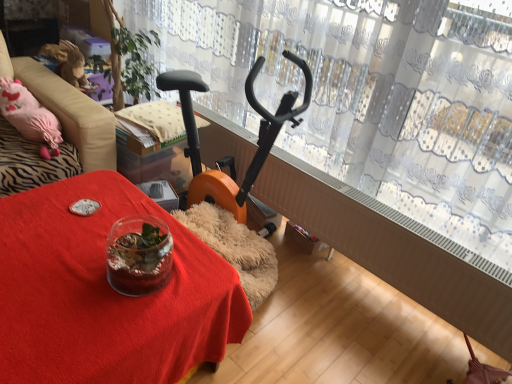
Question: Does velvet pink cushion at left appear on the right side of translucent glass terrarium at center?

Choices:
 (A) yes
 (B) no

Answer: (B)

Question: Considering the relative sizes of velvet pink cushion at left and translucent glass terrarium at center in the image provided, is velvet pink cushion at left shorter than translucent glass terrarium at center?

Choices:
 (A) no
 (B) yes

Answer: (A)

Question: Can you confirm if velvet pink cushion at left is thinner than translucent glass terrarium at center?

Choices:
 (A) no
 (B) yes

Answer: (A)

Question: From the image's perspective, is velvet pink cushion at left beneath translucent glass terrarium at center?

Choices:
 (A) no
 (B) yes

Answer: (A)

Question: Is velvet pink cushion at left directly adjacent to translucent glass terrarium at center?

Choices:
 (A) no
 (B) yes

Answer: (A)

Question: Based on their sizes in the image, would you say velvet pink cushion at left is bigger or smaller than translucent glass terrarium at center?

Choices:
 (A) small
 (B) big

Answer: (B)

Question: Does point (25, 162) appear closer or farther from the camera than point (53, 306)?

Choices:
 (A) farther
 (B) closer

Answer: (A)

Question: From the image's perspective, is velvet pink cushion at left positioned above or below translucent glass terrarium at center?

Choices:
 (A) below
 (B) above

Answer: (B)

Question: Is velvet pink cushion at left to the left or to the right of translucent glass terrarium at center in the image?

Choices:
 (A) left
 (B) right

Answer: (A)

Question: Is transparent lace curtain at upper center situated inside velvet pink cushion at left or outside?

Choices:
 (A) outside
 (B) inside

Answer: (A)

Question: In terms of width, does transparent lace curtain at upper center look wider or thinner when compared to velvet pink cushion at left?

Choices:
 (A) wide
 (B) thin

Answer: (B)

Question: Considering their positions, is transparent lace curtain at upper center located in front of or behind velvet pink cushion at left?

Choices:
 (A) front
 (B) behind

Answer: (A)

Question: From their relative heights in the image, would you say transparent lace curtain at upper center is taller or shorter than velvet pink cushion at left?

Choices:
 (A) short
 (B) tall

Answer: (B)

Question: Considering the relative positions of transparent lace curtain at upper center and translucent glass terrarium at center in the image provided, is transparent lace curtain at upper center to the left or to the right of translucent glass terrarium at center?

Choices:
 (A) left
 (B) right

Answer: (B)

Question: From their relative heights in the image, would you say transparent lace curtain at upper center is taller or shorter than translucent glass terrarium at center?

Choices:
 (A) short
 (B) tall

Answer: (B)